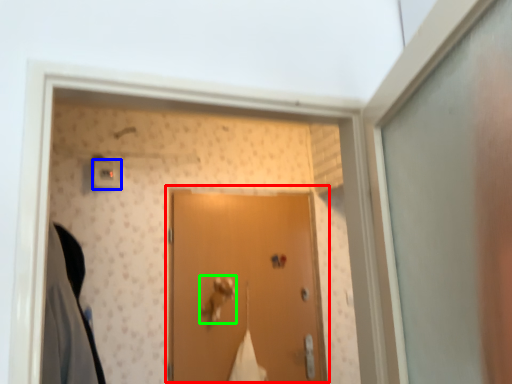
Question: Which object is positioned closest to door (highlighted by a red box)? Select from light switch (highlighted by a blue box) and door handle (highlighted by a green box).

Choices:
 (A) light switch
 (B) door handle

Answer: (B)